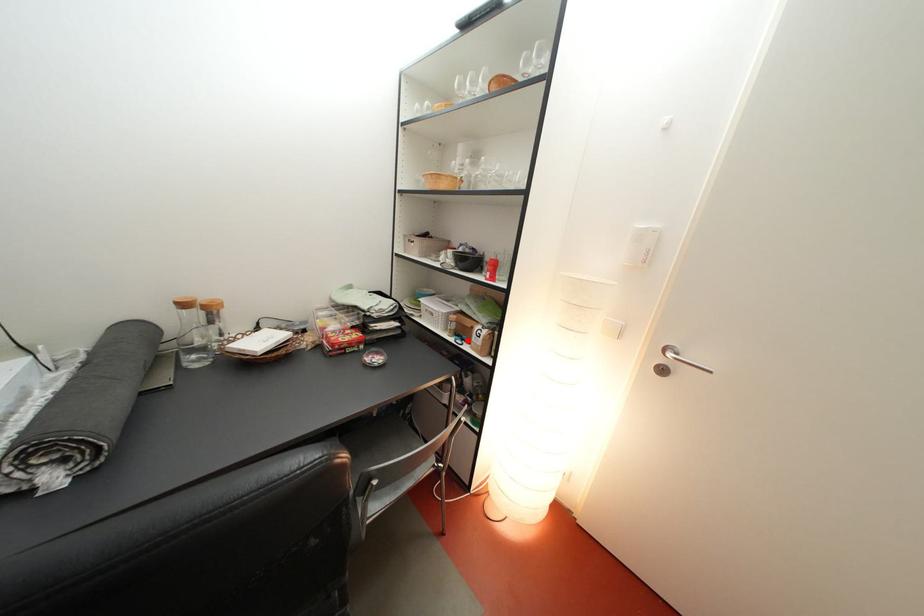
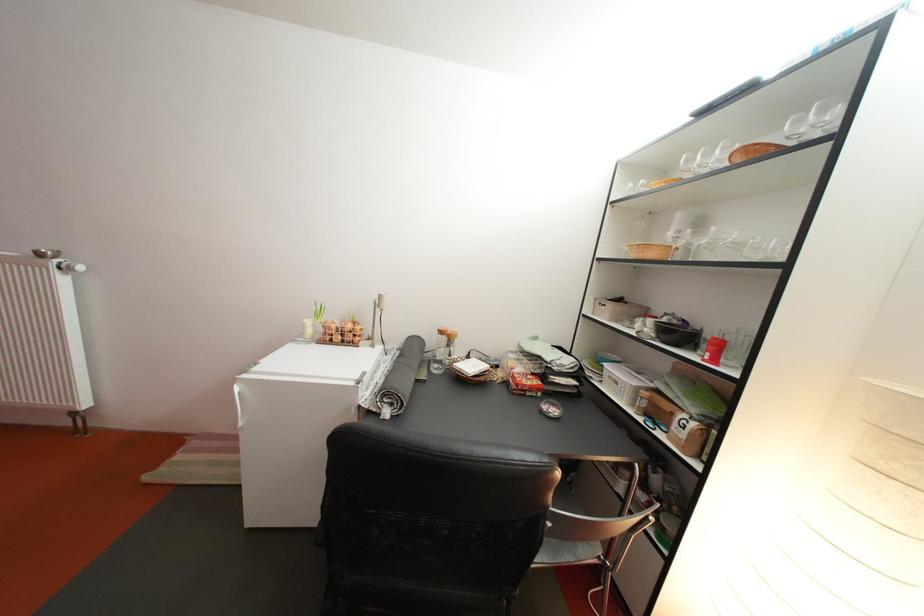
Find the pixel in the second image that matches the highlighted location in the first image.

(658, 421)